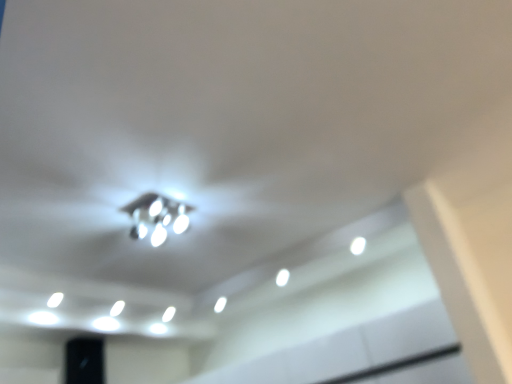
The width and height of the screenshot is (512, 384). What do you see at coordinates (157, 216) in the screenshot? I see `white glossy lamp at center` at bounding box center [157, 216].

The image size is (512, 384). Find the location of `white glossy lamp at center`. white glossy lamp at center is located at coordinates (157, 216).

You are a GUI agent. You are given a task and a screenshot of the screen. Output one action in this format:
    pyautogui.click(x=<x>, y=<y>)
    Task: Click on the white glossy lamp at center
    This screenshot has width=512, height=384.
    Given the screenshot: What is the action you would take?
    [x=157, y=216]